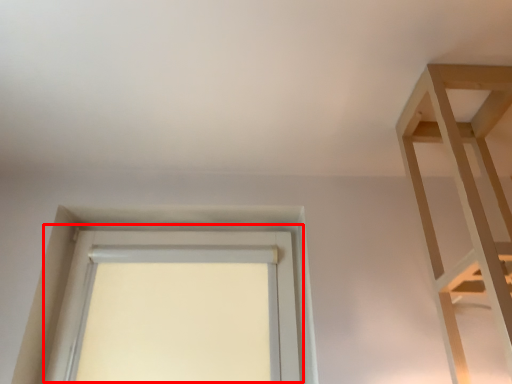
Question: In this image, where is window (annotated by the red box) located relative to shelf?

Choices:
 (A) left
 (B) right

Answer: (A)